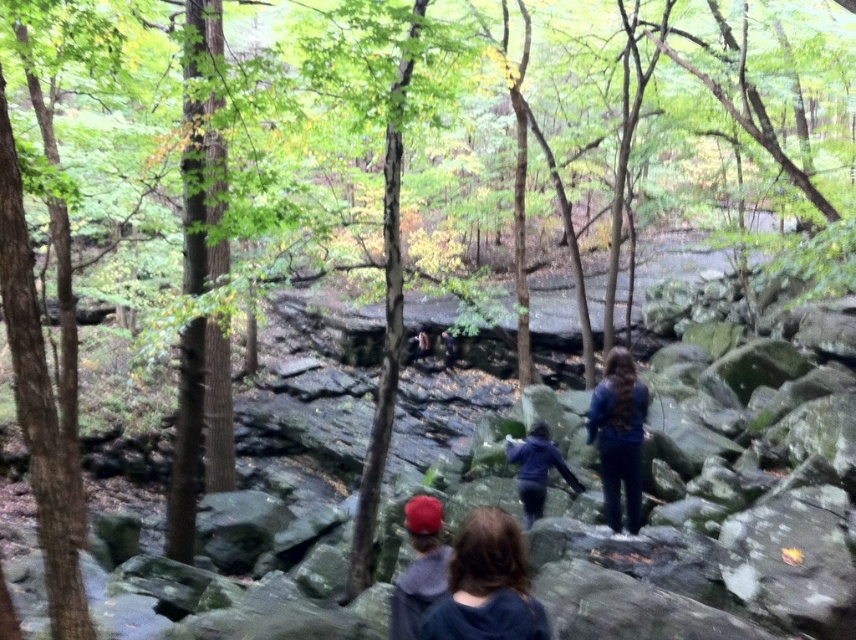
Question: Among these points, which one is nearest to the camera?

Choices:
 (A) (465, 520)
 (B) (428, 572)

Answer: (B)

Question: Which point is farther from the camera taking this photo?

Choices:
 (A) (470, 552)
 (B) (512, 460)
 (C) (440, 573)
 (D) (619, 477)

Answer: (B)

Question: Which of these objects is positioned farthest from the red fabric cap at lower center?

Choices:
 (A) dark blue fabric at center
 (B) dark blue jacket at center

Answer: (B)

Question: Can you confirm if blue fabric at center is positioned above red fabric cap at lower center?

Choices:
 (A) yes
 (B) no

Answer: (A)

Question: Can you confirm if dark blue fabric at center is bigger than dark blue jacket at center?

Choices:
 (A) no
 (B) yes

Answer: (A)

Question: Is dark blue fabric at center above dark blue jacket at center?

Choices:
 (A) no
 (B) yes

Answer: (B)